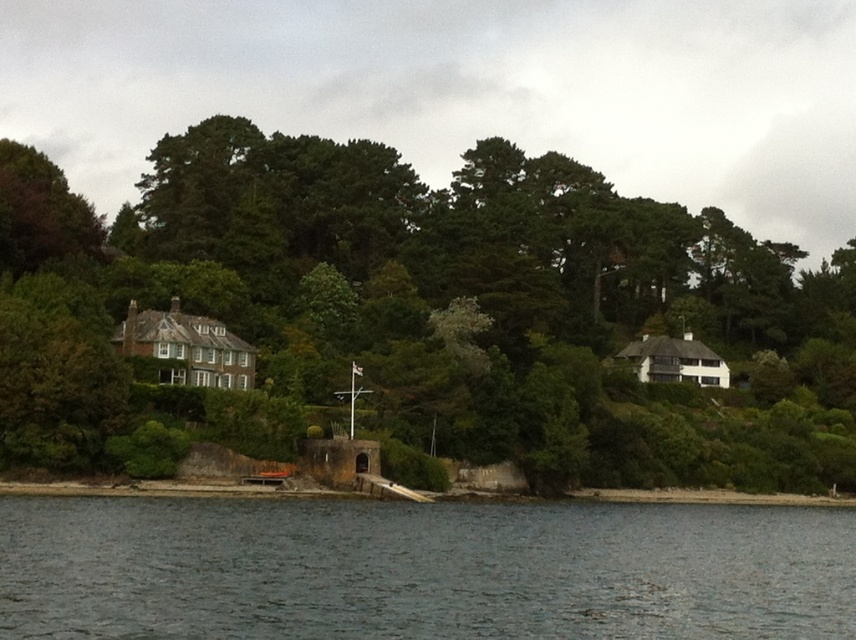
You are standing at the origin point of the coordinate system in the image. You want to walk towards the green leafy tree at center. What direction should you move in?

Since the green leafy tree at center is located at point (419, 314), you should move diagonally towards the center of the image to reach it.